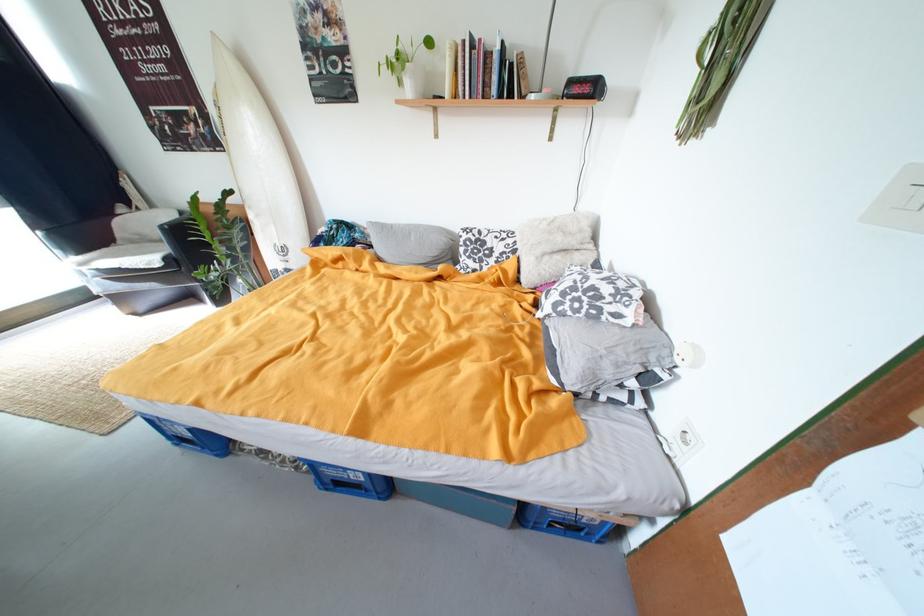
The image size is (924, 616). What do you see at coordinates (684, 440) in the screenshot?
I see `a power outlet socket` at bounding box center [684, 440].